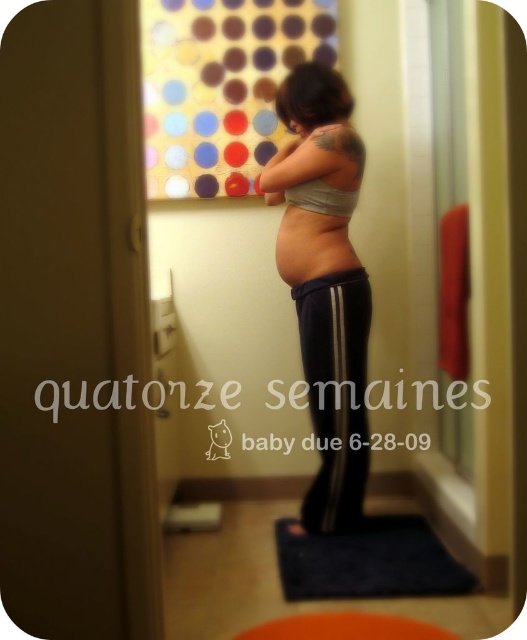
Question: Does navy blue track pants at center have a lesser width compared to orange rubber mat at lower center?

Choices:
 (A) no
 (B) yes

Answer: (B)

Question: Which object is the closest to the navy blue track pants at center?

Choices:
 (A) pink smooth skin at center
 (B) orange rubber mat at lower center

Answer: (A)

Question: From the image, what is the correct spatial relationship of gray matte fabric at center in relation to orange rubber mat at lower center?

Choices:
 (A) left
 (B) right

Answer: (A)

Question: Considering the real-world distances, which object is farthest from the navy blue track pants at center?

Choices:
 (A) blue soft mat at lower center
 (B) gray matte fabric at center

Answer: (A)

Question: Which object is farther from the camera taking this photo?

Choices:
 (A) blue soft mat at lower center
 (B) navy blue track pants at center
 (C) gray matte fabric at center

Answer: (B)

Question: Is navy blue track pants at center below blue soft mat at lower center?

Choices:
 (A) yes
 (B) no

Answer: (B)